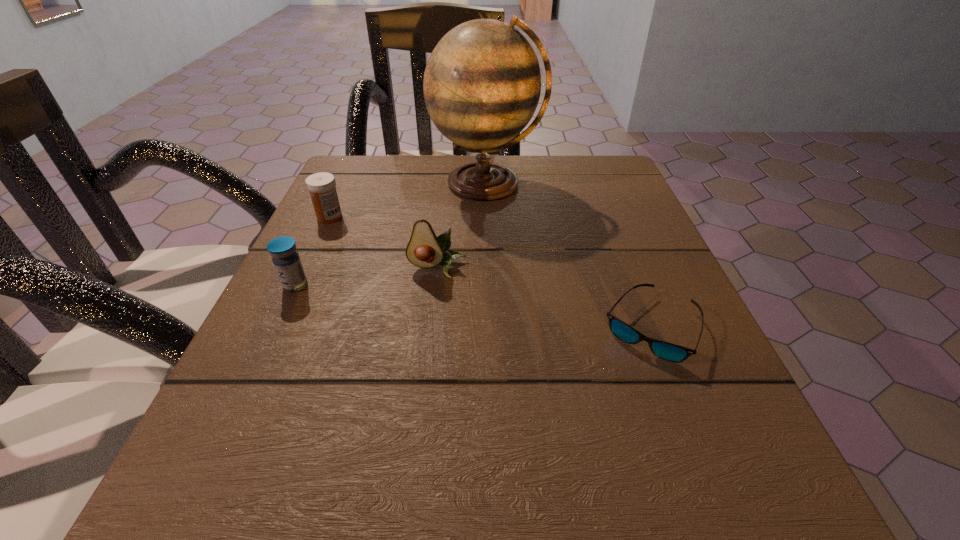
What are the coordinates of `empty space that is in between the farther medicine and the second tallest object` in the screenshot? It's located at (384, 242).

At what (x,y) coordinates should I click in order to perform the action: click on vacant space that is in between the nearer medicine and the farther medicine. Please return your answer as a coordinate pair (x, y). This screenshot has height=540, width=960. Looking at the image, I should click on (313, 251).

The image size is (960, 540). What are the coordinates of `vacant area between the fourth shortest object and the farther medicine` in the screenshot? It's located at (384, 242).

This screenshot has width=960, height=540. What are the coordinates of `empty space that is in between the farther medicine and the second tallest object` in the screenshot? It's located at (384, 242).

I want to click on free area in between the nearer medicine and the globe, so click(391, 234).

The height and width of the screenshot is (540, 960). Identify the location of free space between the tallest object and the nearer medicine. (391, 234).

You are a GUI agent. You are given a task and a screenshot of the screen. Output one action in this format:
    pyautogui.click(x=<x>, y=<y>)
    Task: Click on the empty location between the nearer medicine and the second tallest object
    The height and width of the screenshot is (540, 960).
    Given the screenshot: What is the action you would take?
    pyautogui.click(x=367, y=276)

The width and height of the screenshot is (960, 540). In order to click on empty location between the tallest object and the second tallest object in this screenshot , I will do `click(462, 226)`.

I want to click on vacant region between the globe and the second tallest object, so click(x=462, y=226).

The height and width of the screenshot is (540, 960). In order to click on blank region between the nearer medicine and the shortest object in this screenshot , I will do `click(473, 307)`.